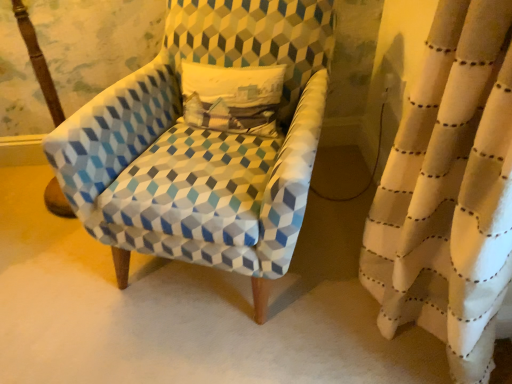
Question: Should I look upward or downward to see textured fabric armchair at center?

Choices:
 (A) up
 (B) down

Answer: (A)